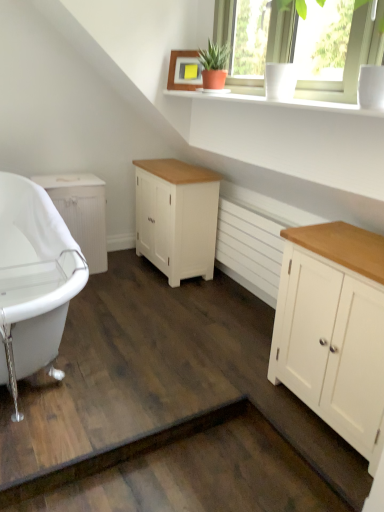
At what (x,y) coordinates should I click in order to perform the action: click on free space in front of white painted wood cabinet at center, acting as the second cabinetry starting from the left. Please return your answer as a coordinate pair (x, y). The width and height of the screenshot is (384, 512). Looking at the image, I should click on (167, 298).